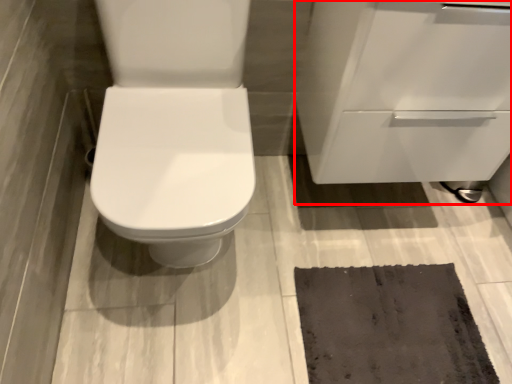
Question: From the image's perspective, where is cabinetry (annotated by the red box) located in relation to doormat in the image?

Choices:
 (A) above
 (B) below

Answer: (A)